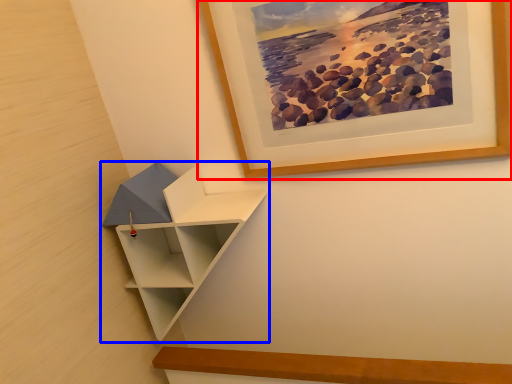
Question: Which of the following is the farthest to the observer, picture frame (highlighted by a red box) or shelf (highlighted by a blue box)?

Choices:
 (A) picture frame
 (B) shelf

Answer: (B)